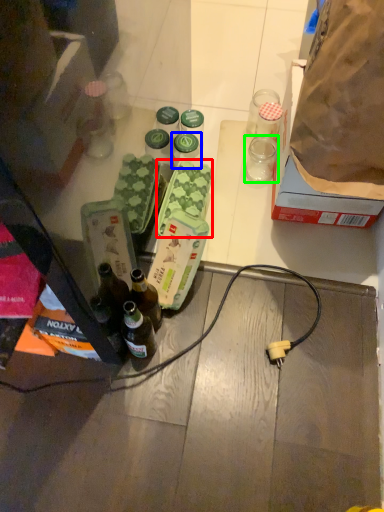
Question: Estimate the real-world distances between objects in this image. Which object is farther from food (highlighted by a red box), bottle (highlighted by a blue box) or coffee cup (highlighted by a green box)?

Choices:
 (A) bottle
 (B) coffee cup

Answer: (B)